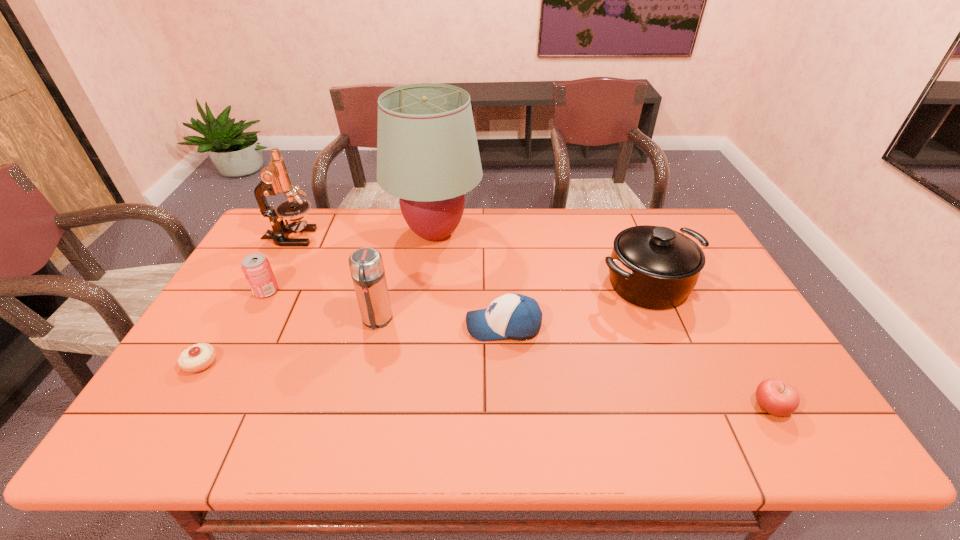
The height and width of the screenshot is (540, 960). Find the location of `lampshade that is at the far edge`. lampshade that is at the far edge is located at coordinates (427, 153).

Identify the location of microscope present at the far edge. (274, 179).

The width and height of the screenshot is (960, 540). Identify the location of object located in the near edge section of the desktop. (777, 397).

I want to click on microscope at the left edge, so click(274, 179).

The image size is (960, 540). I want to click on soda can located at the left edge, so click(x=256, y=267).

The image size is (960, 540). Identify the location of pastry situated at the left edge. (198, 357).

I want to click on saucepan present at the right edge, so click(653, 267).

Where is `apple that is at the right edge`? The height and width of the screenshot is (540, 960). apple that is at the right edge is located at coordinates pyautogui.click(x=777, y=397).

The width and height of the screenshot is (960, 540). Identify the location of object present at the far left corner. (274, 179).

You are a GUI agent. You are given a task and a screenshot of the screen. Output one action in this format:
    pyautogui.click(x=<x>, y=<y>)
    Task: Click on the object located at the near right corner
    
    Given the screenshot: What is the action you would take?
    pyautogui.click(x=777, y=397)